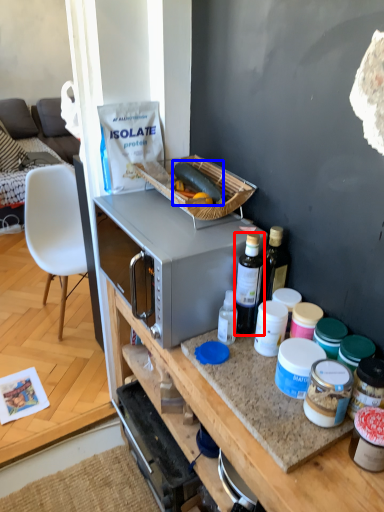
Question: Which object appears closest to the camera in this image, bottle (highlighted by a red box) or food (highlighted by a blue box)?

Choices:
 (A) bottle
 (B) food

Answer: (A)